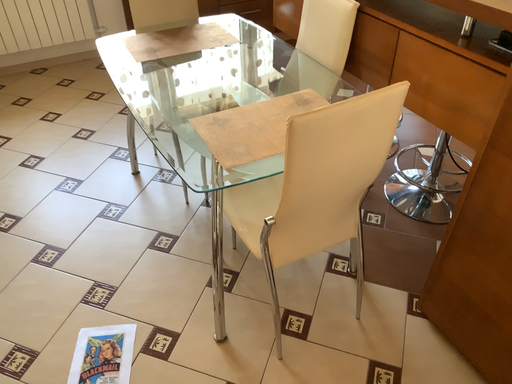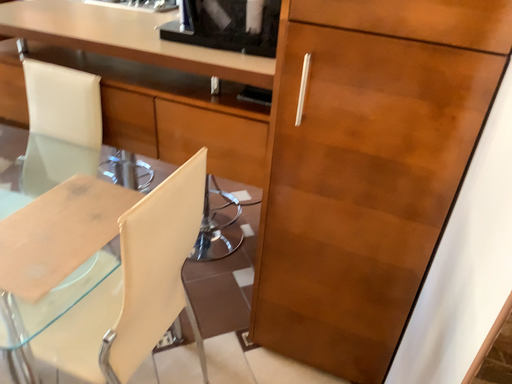
Question: Which way did the camera rotate in the video?

Choices:
 (A) rotated left
 (B) rotated right

Answer: (B)